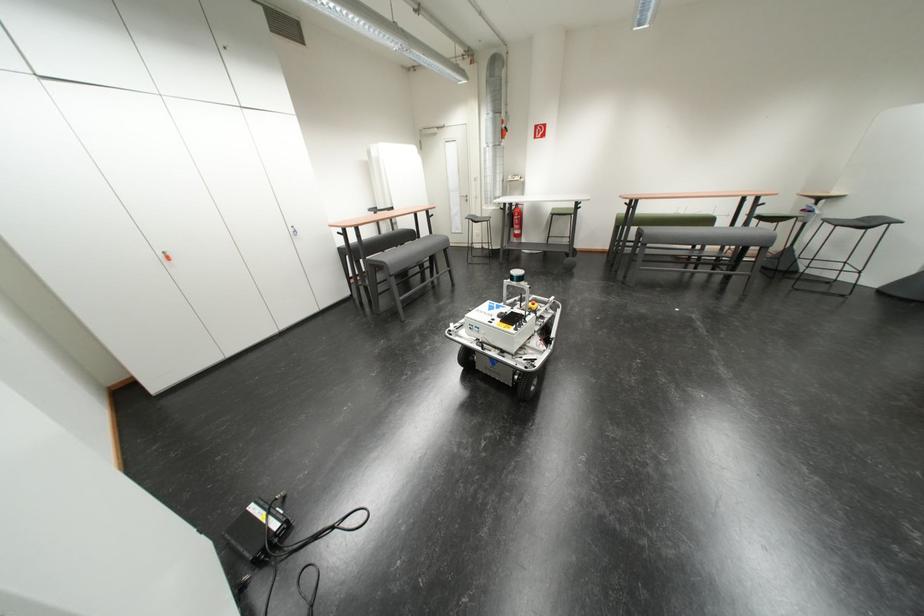
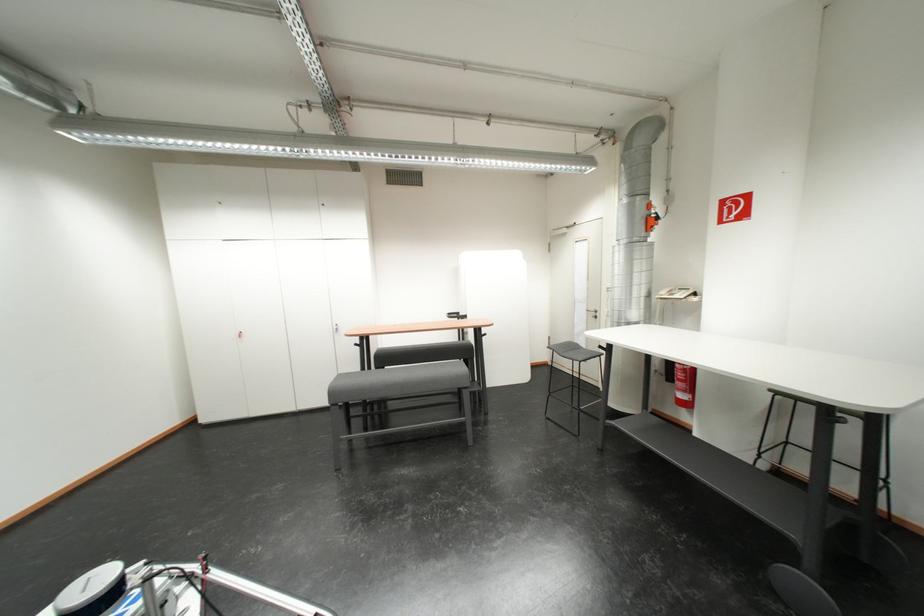
In the second image, find the point that corresponds to point (521, 180) in the first image.

(675, 296)